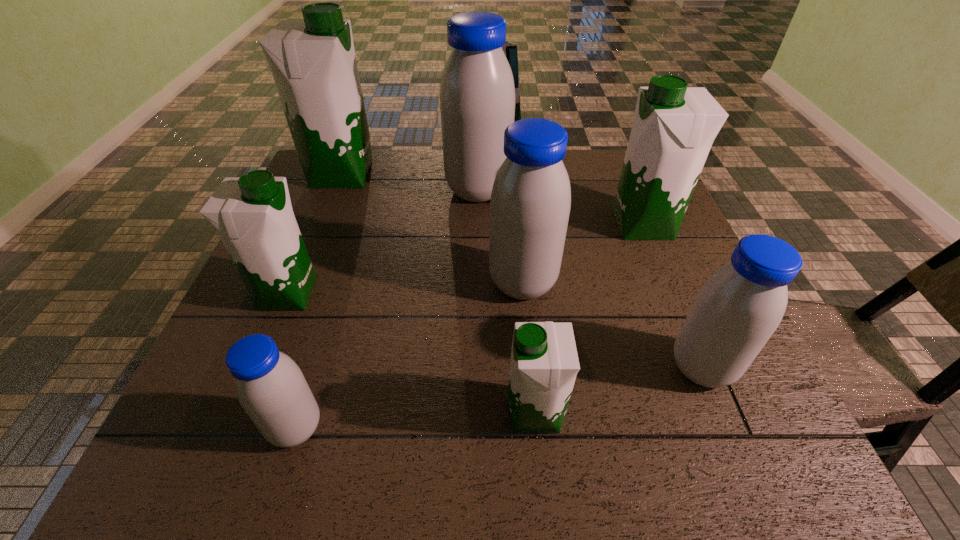
Image resolution: width=960 pixels, height=540 pixels. In the image, there is a desktop. In order to click on free space at the near left corner in this screenshot , I will do `click(162, 459)`.

Find the location of `vacant space in between the second farthest green soya milk and the smallest green soya milk`. vacant space in between the second farthest green soya milk and the smallest green soya milk is located at coordinates (589, 319).

Image resolution: width=960 pixels, height=540 pixels. In order to click on vacant area that lies between the farthest blue soya milk and the nearest green soya milk in this screenshot , I will do `click(507, 302)`.

The height and width of the screenshot is (540, 960). I want to click on unoccupied position between the smallest blue soya milk and the second biggest blue soya milk, so click(409, 355).

The height and width of the screenshot is (540, 960). I want to click on empty location between the second biggest blue soya milk and the rightmost green soya milk, so click(x=583, y=254).

The image size is (960, 540). What are the coordinates of `vacant space that's between the third nearest green soya milk and the rightmost blue soya milk` in the screenshot? It's located at (672, 296).

You are a GUI agent. You are given a task and a screenshot of the screen. Output one action in this format:
    pyautogui.click(x=<x>, y=<y>)
    Task: Click on the free area in between the smallest blue soya milk and the nearest green soya milk
    This screenshot has width=960, height=540.
    Given the screenshot: What is the action you would take?
    pyautogui.click(x=416, y=420)

At what (x,y) coordinates should I click in order to perform the action: click on the seventh closest object to the farthest green soya milk. Please return your answer as a coordinate pair (x, y). This screenshot has height=540, width=960. Looking at the image, I should click on (739, 307).

Where is `the third closest object to the biggest green soya milk`? the third closest object to the biggest green soya milk is located at coordinates (530, 203).

Identify which soya milk is the closest to the smallest blue soya milk. Please provide its 2D coordinates. Your answer should be formatted as a tuple, i.e. [(x, y)], where the tuple contains the x and y coordinates of a point satisfying the conditions above.

[(253, 215)]